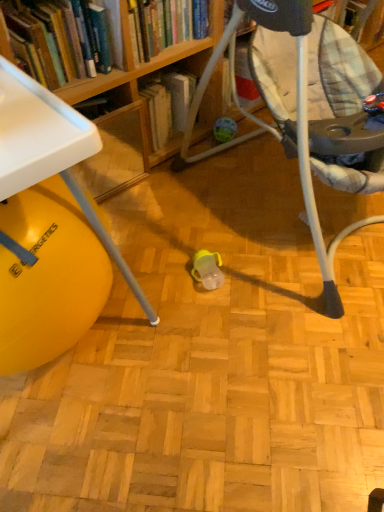
Question: Visually, is matte plastic baby swing at center positioned to the left or to the right of hardcover book at upper left, which is counted as the 2th book, starting from the left?

Choices:
 (A) right
 (B) left

Answer: (A)

Question: Looking at the image, does matte plastic baby swing at center seem bigger or smaller compared to hardcover book at upper left, the first book from the right?

Choices:
 (A) small
 (B) big

Answer: (B)

Question: Which object is the farthest from the hardcover book at upper left, the first book from the right?

Choices:
 (A) matte plastic baby swing at center
 (B) white plastic table at lower left
 (C) hardcover book at upper left, which is counted as the 2th book, starting from the right

Answer: (B)

Question: Which of these objects is positioned closest to the hardcover book at upper left, the first book when ordered from left to right?

Choices:
 (A) matte plastic baby swing at center
 (B) white plastic table at lower left
 (C) hardcover book at upper left, which is counted as the 2th book, starting from the left

Answer: (C)